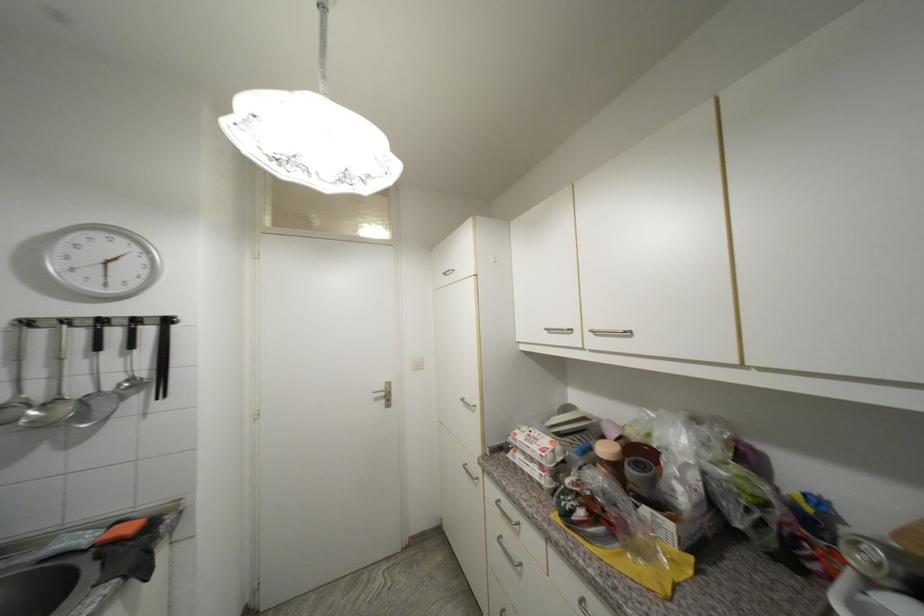
Find the location of a particular element. This screenshot has width=924, height=616. metal door handle is located at coordinates (385, 395).